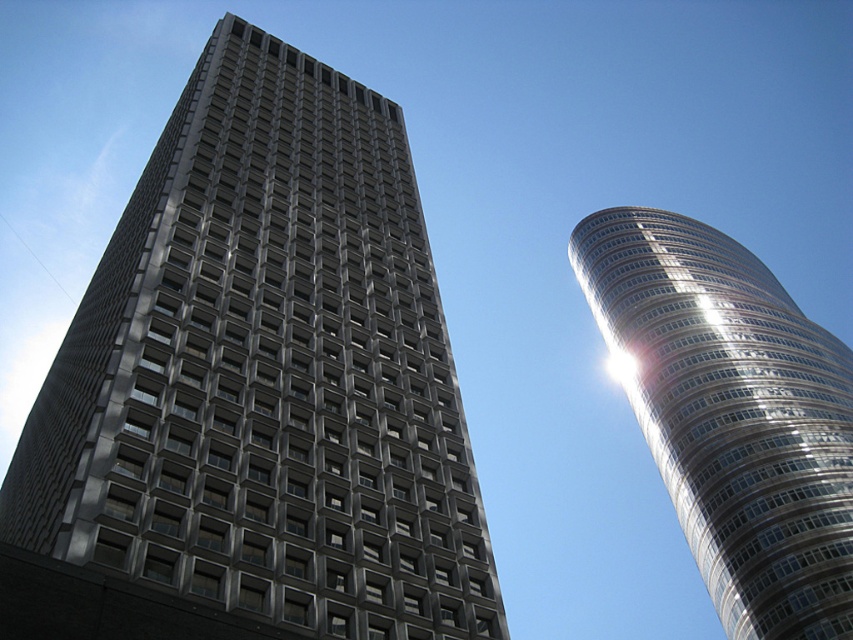
You are an architect reviewing a cityscape design. You notice the matte gray building at center and the shiny silver tower at right. Based on their positions in the scene, which building appears higher in the image?

The matte gray building at center appears higher in the image because it is positioned above the shiny silver tower at right.

You are a drone operator trying to fly a drone between the two skyscrapers. The drone has a height limit of 100 meters. Given that the shiny silver tower at right is 120 meters tall and the matte gray building at center is 80 meters tall, can the drone safely pass between them without hitting either building?

The matte gray building at center is 80 meters tall and the shiny silver tower at right is 120 meters tall. Since the drone has a height limit of 100 meters, it can safely pass under the shiny silver tower at right but cannot go over the matte gray building at center. However, the question mentions flying between them, so the drone must navigate between the two. Since the matte gray building is shorter, the drone can fly above it but stay below the taller shiny silver tower. Wait, but the height limit is 10